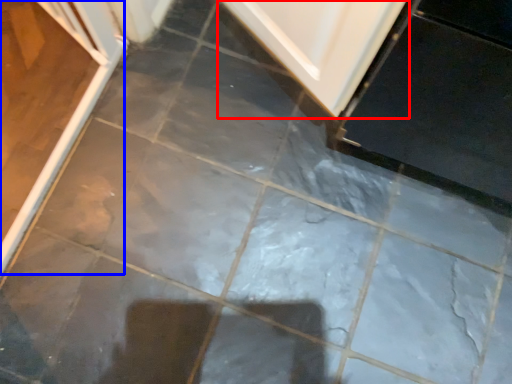
Question: Which object is closer to the camera taking this photo, door (highlighted by a red box) or screen door (highlighted by a blue box)?

Choices:
 (A) door
 (B) screen door

Answer: (B)